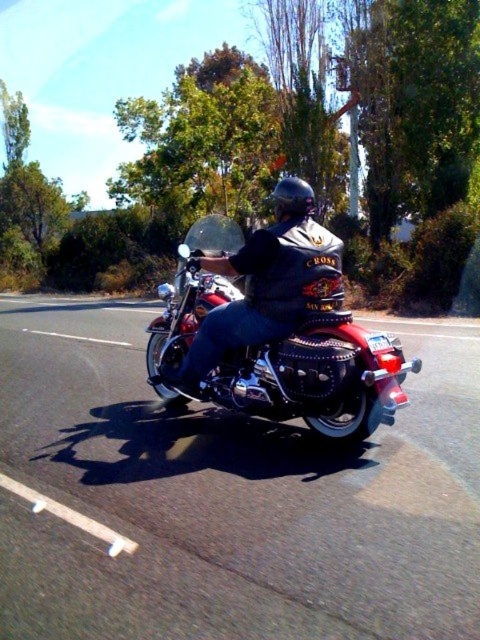
Question: Estimate the real-world distances between objects in this image. Which object is farther from the shiny chrome motorcycle at center?

Choices:
 (A) black leather jacket at center
 (B) metallic chrome motorcycle at center

Answer: (B)

Question: Can you confirm if metallic chrome motorcycle at center is positioned to the right of shiny chrome motorcycle at center?

Choices:
 (A) yes
 (B) no

Answer: (A)

Question: Based on their relative distances, which object is nearer to the shiny chrome motorcycle at center?

Choices:
 (A) metallic chrome motorcycle at center
 (B) black leather jacket at center

Answer: (B)

Question: Among these objects, which one is nearest to the camera?

Choices:
 (A) shiny chrome motorcycle at center
 (B) black leather jacket at center

Answer: (A)

Question: Does metallic chrome motorcycle at center have a lesser width compared to shiny chrome motorcycle at center?

Choices:
 (A) yes
 (B) no

Answer: (B)

Question: Does metallic chrome motorcycle at center have a lesser width compared to shiny chrome motorcycle at center?

Choices:
 (A) no
 (B) yes

Answer: (A)